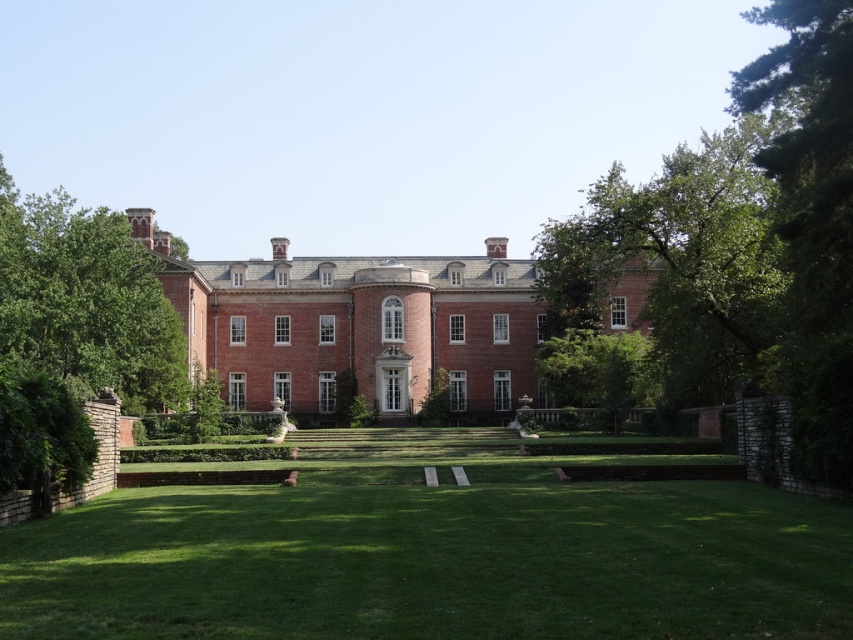
Which is more to the right, brick mansion at center or green leafy tree at left?

brick mansion at center

This screenshot has width=853, height=640. What do you see at coordinates (357, 326) in the screenshot? I see `brick mansion at center` at bounding box center [357, 326].

Describe the element at coordinates (357, 326) in the screenshot. The width and height of the screenshot is (853, 640). I see `brick mansion at center` at that location.

I want to click on brick mansion at center, so click(x=357, y=326).

Between point (274, 592) and point (103, 243), which one is positioned in front?

Point (274, 592) is more forward.

Between green grass at center and green leafy tree at left, which one appears on the right side from the viewer's perspective?

Positioned to the right is green grass at center.

Is point (62, 560) positioned in front of point (148, 291)?

Yes.

I want to click on green grass at center, so click(434, 557).

Does green grass at center come in front of green leafy tree at right?

Yes, it is.

Is green grass at center thinner than green leafy tree at right?

No.

Which is behind, point (386, 556) or point (614, 252)?

Positioned behind is point (614, 252).

The width and height of the screenshot is (853, 640). I want to click on green grass at center, so click(434, 557).